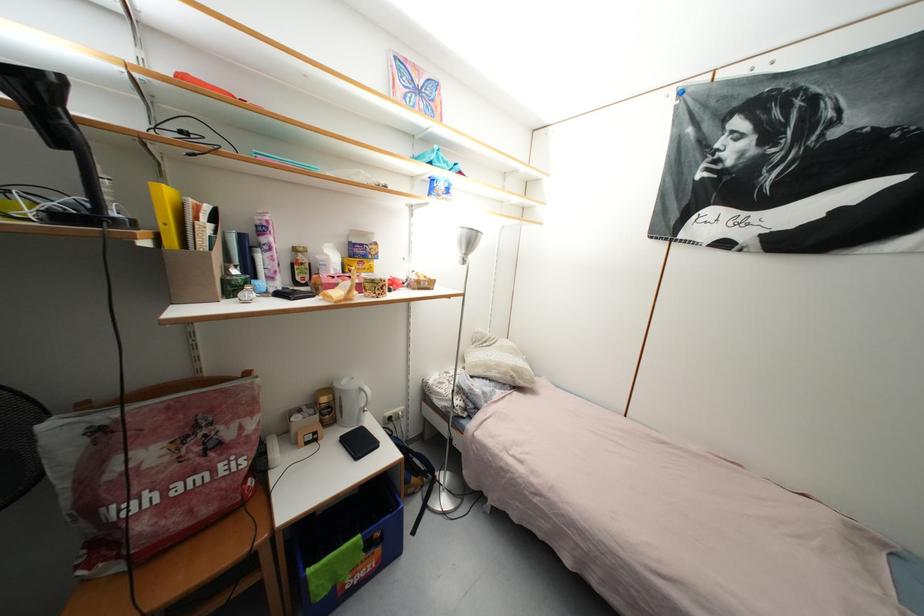
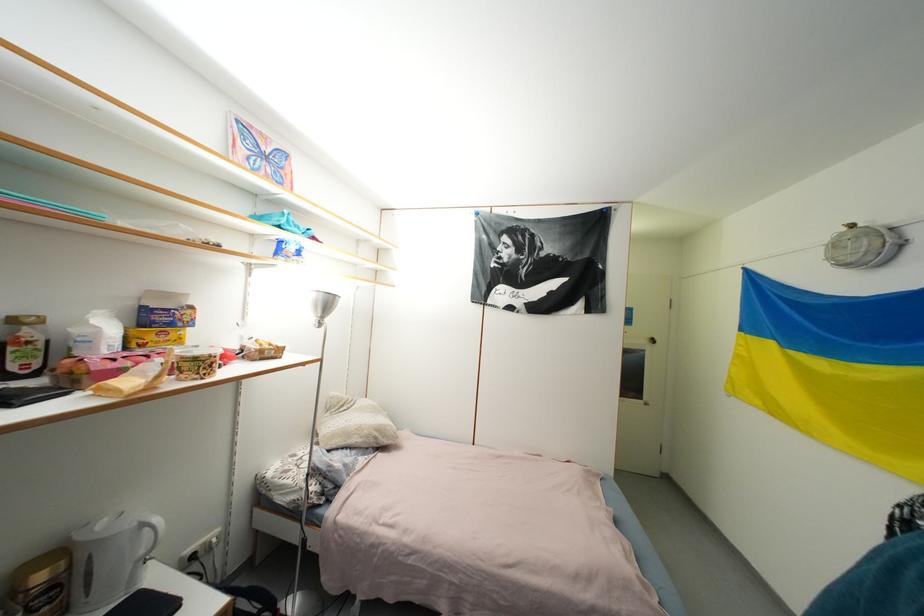
Question: I am providing you with two images of the same scene from different viewpoints. Which of the following objects are not visible in image2?

Choices:
 (A) white plastic container
 (B) silver lamp head
 (C) door handle
 (D) none of these

Answer: (D)